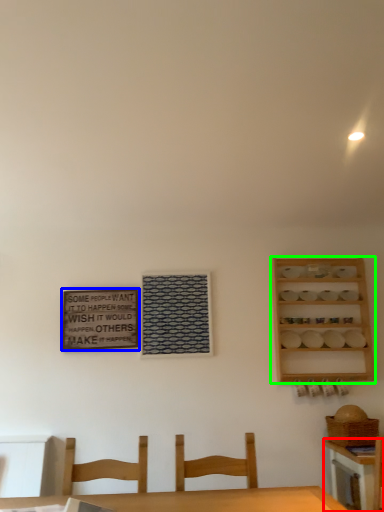
Question: Which is nearer to the table (highlighted by a red box)? bulletin board (highlighted by a blue box) or shelf (highlighted by a green box).

Choices:
 (A) bulletin board
 (B) shelf

Answer: (B)